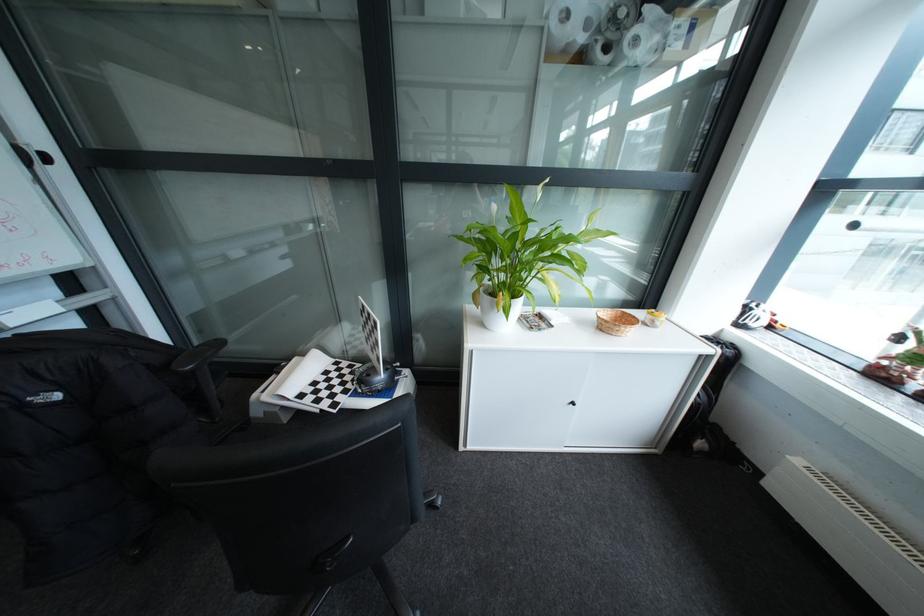
The width and height of the screenshot is (924, 616). What do you see at coordinates (331, 554) in the screenshot?
I see `the chair adjustment lever` at bounding box center [331, 554].